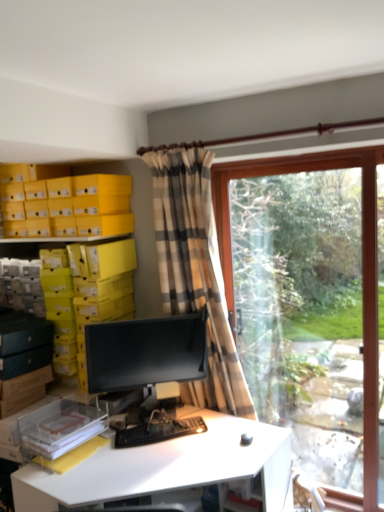
The image size is (384, 512). In order to click on vacant region to the right of black matte keyboard at center in this screenshot , I will do `click(217, 438)`.